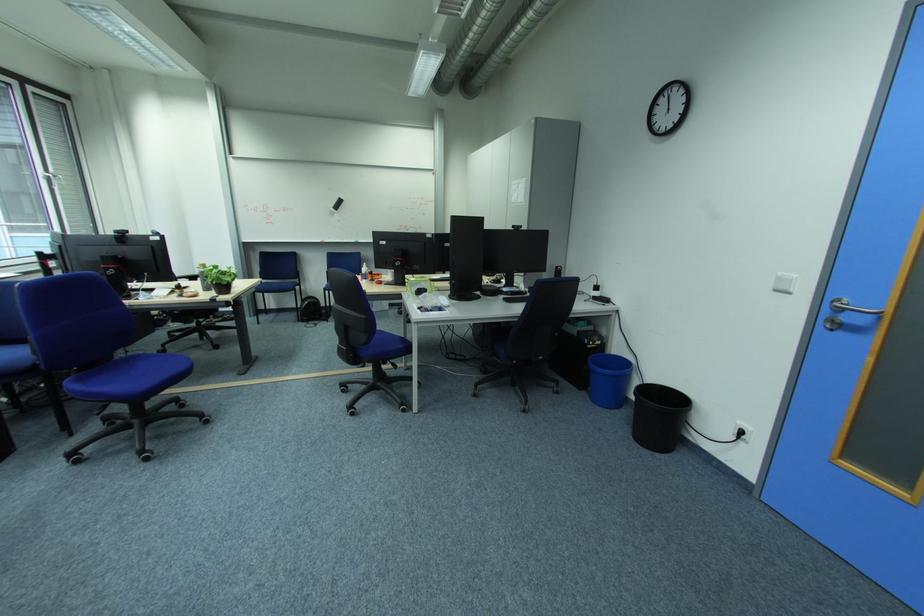
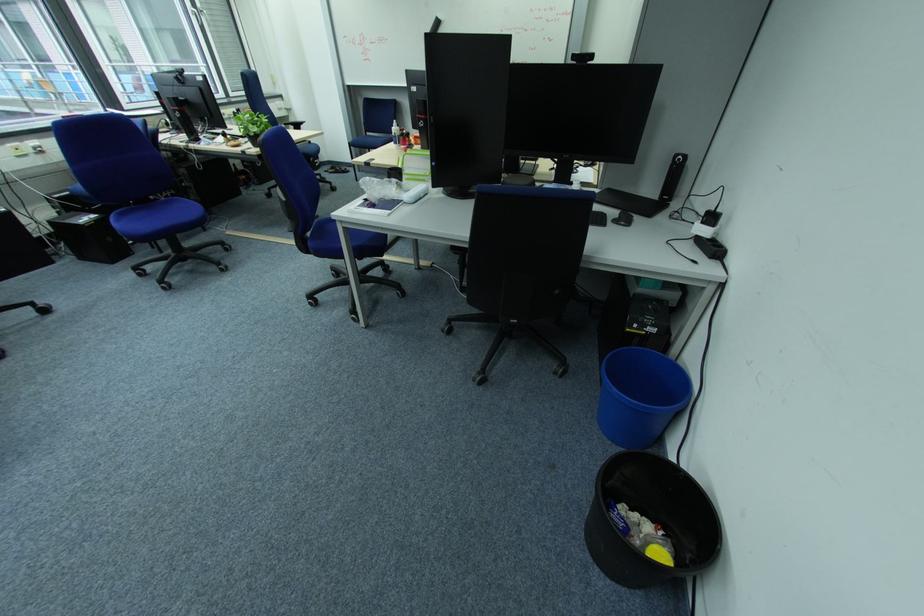
Locate, in the second image, the point that corresponds to point (565, 268) in the first image.

(686, 156)